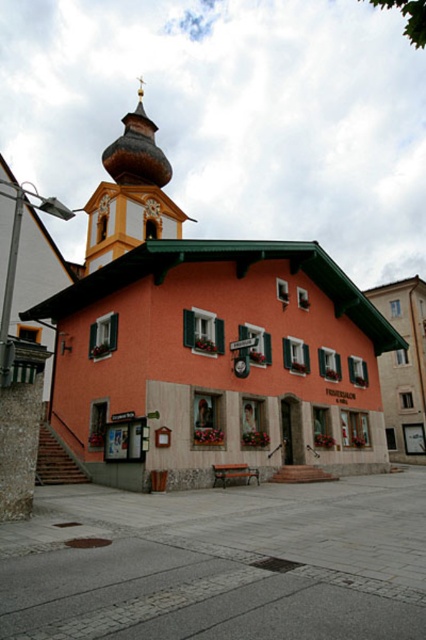
You are standing in front of the charming building and want to enter the church. The entrance is near the orange painted wooden church at center and the metallic clock at center. Which one is closer to the entrance?

The orange painted wooden church at center is positioned on the left side of metallic clock at center, so the entrance is closer to the orange painted wooden church at center.

You are standing on the gray concrete plaza at lower center and want to reach the entrance of the building. Which direction should you move relative to the metallic clock at center?

You should move away from the metallic clock at center because the gray concrete plaza at lower center is in front of it, meaning the entrance is behind the clock.